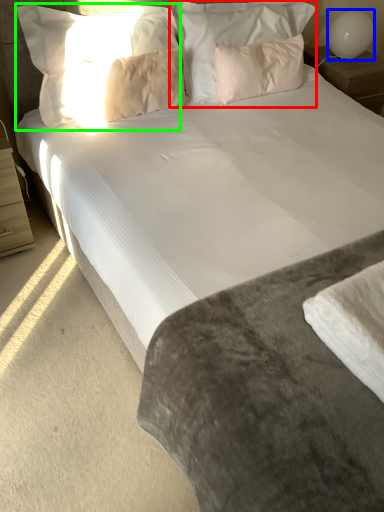
Question: Estimate the real-world distances between objects in this image. Which object is farther from pillow (highlighted by a red box), table lamp (highlighted by a blue box) or pillow (highlighted by a green box)?

Choices:
 (A) table lamp
 (B) pillow

Answer: (A)